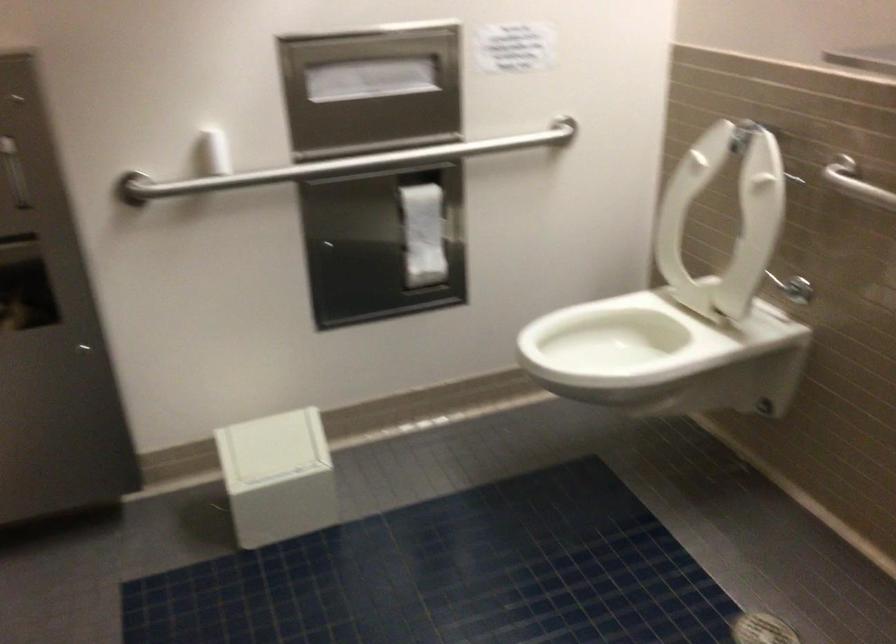
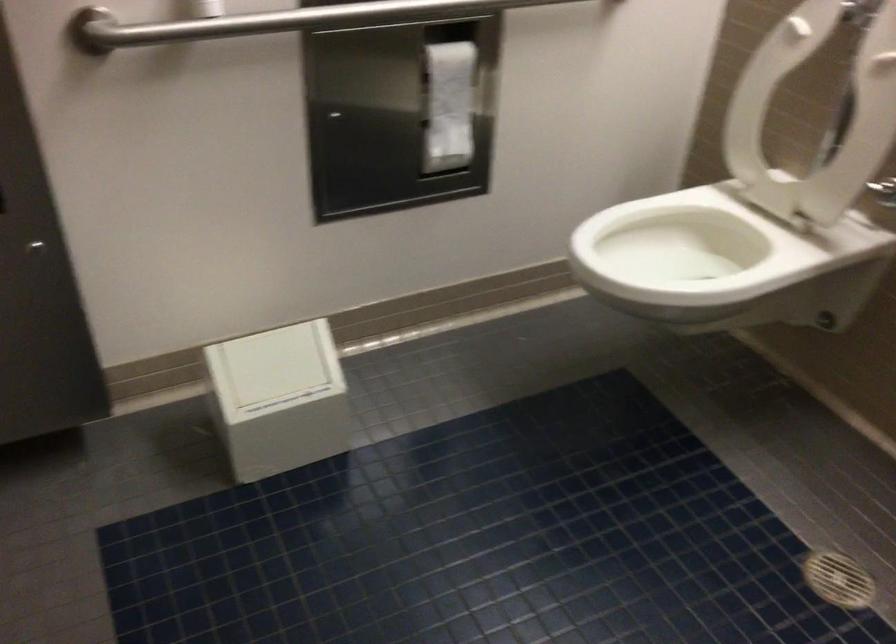
In the second image, find the point that corresponds to (x=633, y=343) in the first image.

(684, 245)